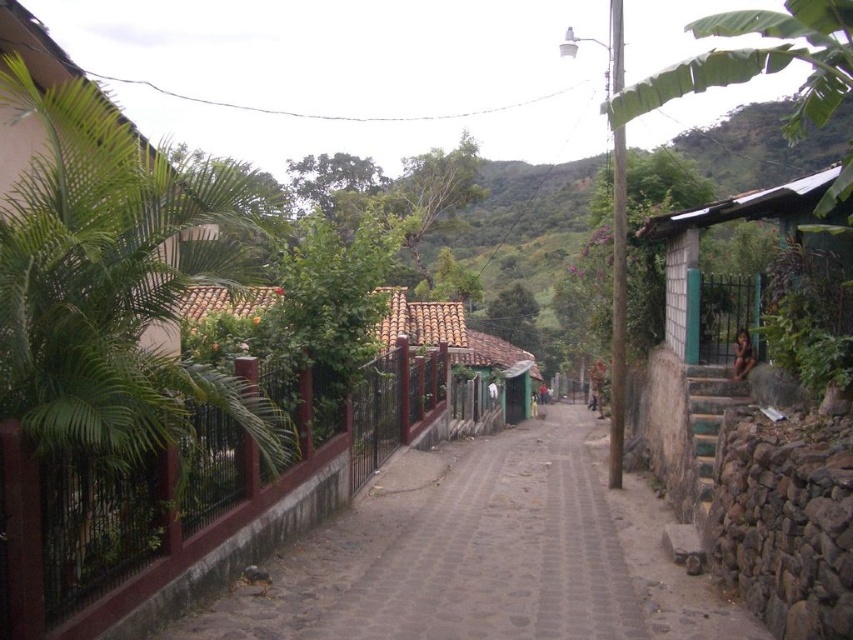
You are a delivery person with a cart that is 1.5 meters long. You need to navigate through the narrow cobblestone street shown in the image. Can your cart fit along the brown cobblestone path at center if you position it directly towards the camera?

The distance between the brown cobblestone path at center and the camera is 5.64 meters. Since your cart is only 1.5 meters long, it will fit comfortably along the path without any issues.

You are a delivery person with a cart that is 5 feet wide. You need to deliver a package to the green corrugated metal hut at right. The brown cobblestone path at center is the only path available. Can your cart fit through the path to reach the hut?

The distance between the brown cobblestone path at center and the green corrugated metal hut at right is 8.21 feet. Since your cart is 5 feet wide, it can fit through the path as the path is wider than the cart.

You are a delivery person with a cart that is 1.2 meters wide. You need to navigate through the narrow cobblestone street to deliver a package to the green corrugated metal hut at right. Can your cart fit through the brown cobblestone path at center?

The brown cobblestone path at center is wider than the green corrugated metal hut at right. Since your cart is 1.2 meters wide, it should fit through the path as long as the path is at least 1.2 meters wide. However, the exact width isn